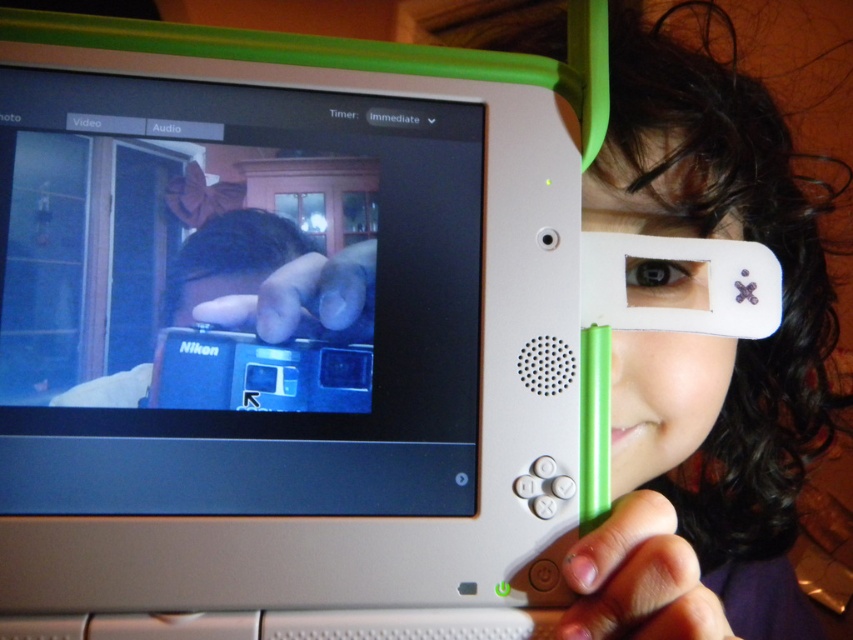
Who is higher up, matte white eye at upper right or blue plastic camera at center?

matte white eye at upper right is higher up.

Who is positioned more to the left, matte white eye at upper right or blue plastic camera at center?

From the viewer's perspective, blue plastic camera at center appears more on the left side.

Does point (614, 150) come in front of point (280, 304)?

No, it is behind (280, 304).

Where is `matte white eye at upper right`? matte white eye at upper right is located at coordinates (663, 401).

Based on the photo, which is below, metallic blue camera at center or blue plastic camera at center?

blue plastic camera at center is below.

Who is more forward, (x=387, y=163) or (x=347, y=316)?

Point (x=347, y=316)

The image size is (853, 640). What do you see at coordinates (236, 298) in the screenshot?
I see `metallic blue camera at center` at bounding box center [236, 298].

The image size is (853, 640). In order to click on metallic blue camera at center in this screenshot , I will do `click(236, 298)`.

Between metallic blue camera at center and matte white eye at upper right, which one is positioned lower?

matte white eye at upper right is below.

Which is behind, point (393, 129) or point (666, 140)?

Positioned behind is point (666, 140).

The height and width of the screenshot is (640, 853). Identify the location of metallic blue camera at center. pos(236,298).